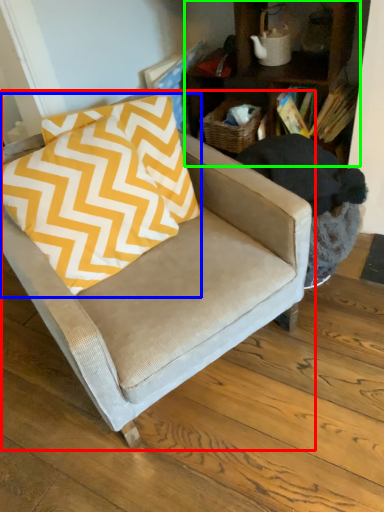
Question: Which object is the farthest from chair (highlighted by a red box)? Choose among these: pillow (highlighted by a blue box) or bookcase (highlighted by a green box).

Choices:
 (A) pillow
 (B) bookcase

Answer: (B)